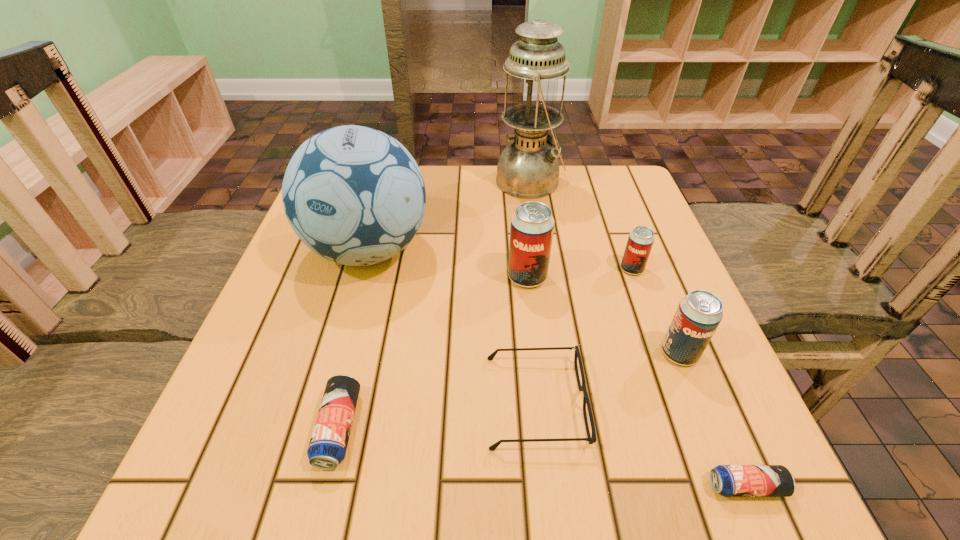
Where is `the second shortest beer can`? Image resolution: width=960 pixels, height=540 pixels. the second shortest beer can is located at coordinates (328, 444).

Locate an element on the screen. the fourth farthest beer can is located at coordinates (328, 444).

Image resolution: width=960 pixels, height=540 pixels. In order to click on spectacles in this screenshot , I will do `click(592, 439)`.

Find the location of a particular element. This screenshot has height=540, width=960. the nearer blue beer can is located at coordinates (728, 480).

The image size is (960, 540). I want to click on the right blue beer can, so click(x=728, y=480).

You are a GUI agent. You are given a task and a screenshot of the screen. Output one action in this format:
    pyautogui.click(x=<x>, y=<y>)
    Task: Click on the free spot located on the front of the farthest object
    This screenshot has height=540, width=960.
    Given the screenshot: What is the action you would take?
    pyautogui.click(x=543, y=276)

Find the location of a particular element. The height and width of the screenshot is (540, 960). blank space located 0.150m on the side with brand of the soccer ball is located at coordinates (339, 357).

Locate an element on the screen. vacant region located on the back of the leftmost red beer can is located at coordinates pos(518,198).

Identify the location of free space located on the left of the nearest red beer can. (559, 353).

At what (x,y) coordinates should I click in order to perform the action: click on free space located on the front of the fifth tallest object. Please return your answer as a coordinate pair (x, y). Looking at the image, I should click on (648, 313).